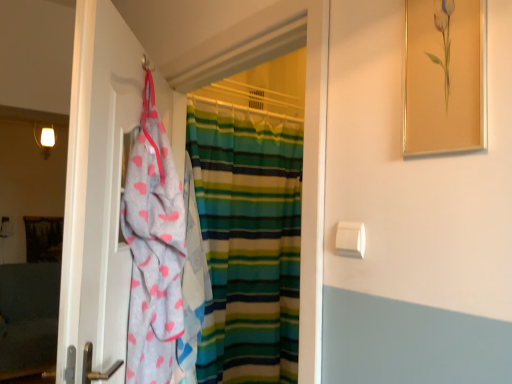
Question: From a real-world perspective, is gray fabric towel at left over gold-framed painting at upper right?

Choices:
 (A) no
 (B) yes

Answer: (A)

Question: Does gray fabric towel at left have a smaller size compared to gold-framed painting at upper right?

Choices:
 (A) no
 (B) yes

Answer: (A)

Question: Is gold-framed painting at upper right inside gray fabric towel at left?

Choices:
 (A) yes
 (B) no

Answer: (B)

Question: Is gray fabric towel at left behind gold-framed painting at upper right?

Choices:
 (A) yes
 (B) no

Answer: (A)

Question: Considering the relative sizes of gray fabric towel at left and gold-framed painting at upper right in the image provided, is gray fabric towel at left wider than gold-framed painting at upper right?

Choices:
 (A) no
 (B) yes

Answer: (B)

Question: Is gray fabric towel at left aimed at gold-framed painting at upper right?

Choices:
 (A) no
 (B) yes

Answer: (A)

Question: Is gray fabric towel at left to the right of white plastic towel bar at center right from the viewer's perspective?

Choices:
 (A) no
 (B) yes

Answer: (A)

Question: Are gray fabric towel at left and white plastic towel bar at center right beside each other?

Choices:
 (A) yes
 (B) no

Answer: (B)

Question: Is gray fabric towel at left aimed at white plastic towel bar at center right?

Choices:
 (A) no
 (B) yes

Answer: (A)

Question: Does gray fabric towel at left contain white plastic towel bar at center right?

Choices:
 (A) yes
 (B) no

Answer: (B)

Question: From a real-world perspective, is gray fabric towel at left on top of white plastic towel bar at center right?

Choices:
 (A) yes
 (B) no

Answer: (B)

Question: From the image's perspective, is gray fabric towel at left on white plastic towel bar at center right?

Choices:
 (A) no
 (B) yes

Answer: (A)

Question: From a real-world perspective, does gold-framed painting at upper right stand above gray fabric towel at left?

Choices:
 (A) no
 (B) yes

Answer: (B)